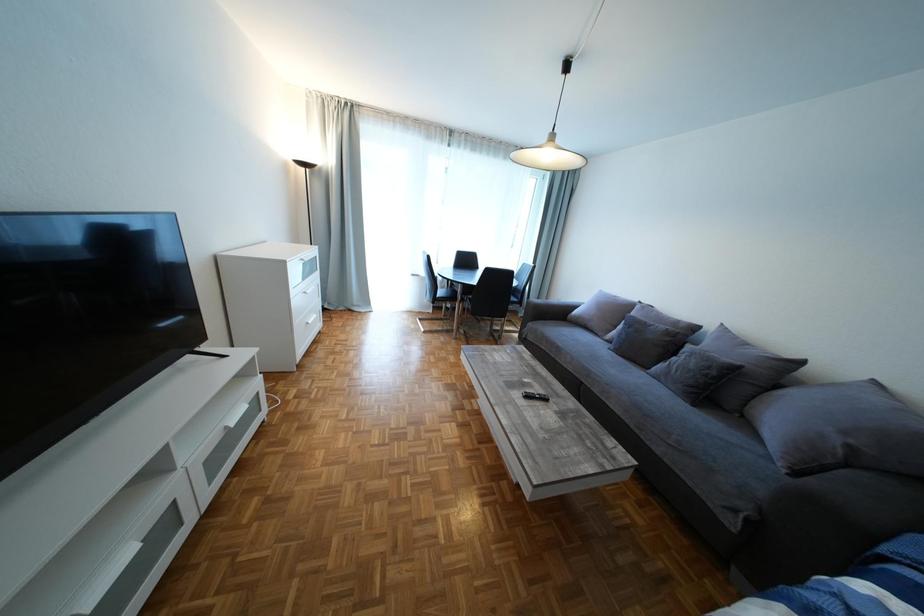
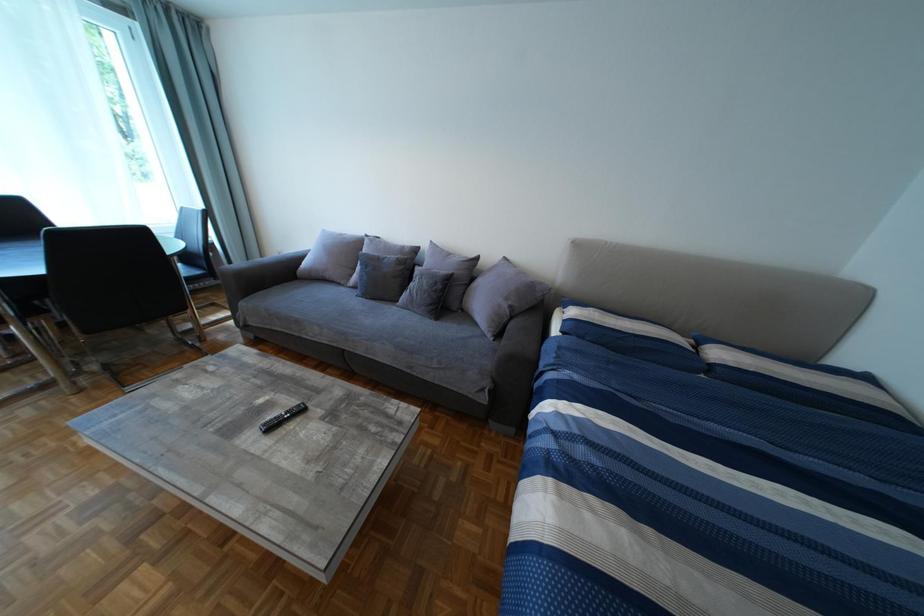
The images are taken continuously from a first-person perspective. In which direction is your viewpoint rotating?

The camera rotated toward right-down.